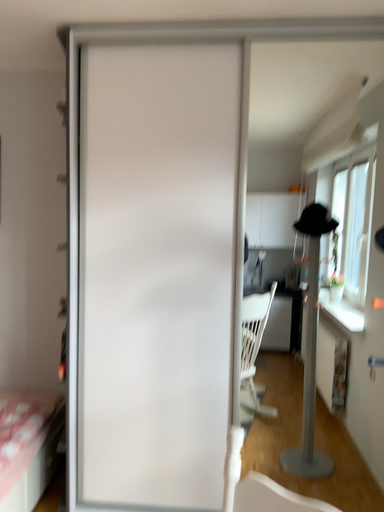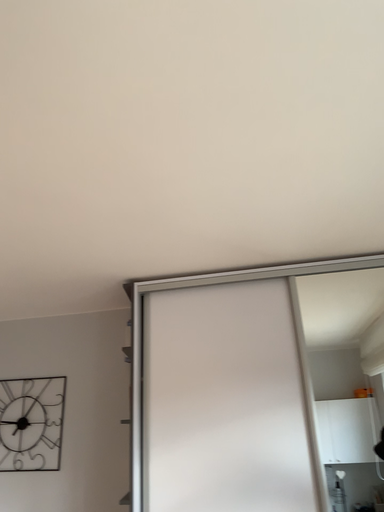
Question: Which way did the camera rotate in the video?

Choices:
 (A) rotated upward
 (B) rotated downward

Answer: (A)